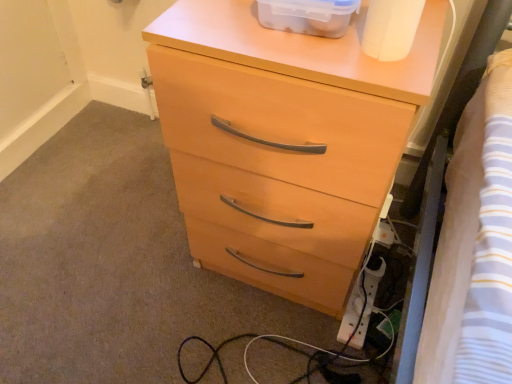
Question: Is translucent plastic container at upper center at the right side of white plastic extension cord at lower right?

Choices:
 (A) yes
 (B) no

Answer: (B)

Question: Is translucent plastic container at upper center to the left of white plastic extension cord at lower right from the viewer's perspective?

Choices:
 (A) yes
 (B) no

Answer: (A)

Question: Does translucent plastic container at upper center have a greater width compared to white plastic extension cord at lower right?

Choices:
 (A) no
 (B) yes

Answer: (A)

Question: Can you confirm if translucent plastic container at upper center is taller than white plastic extension cord at lower right?

Choices:
 (A) yes
 (B) no

Answer: (A)

Question: Is translucent plastic container at upper center bigger than white plastic extension cord at lower right?

Choices:
 (A) yes
 (B) no

Answer: (A)

Question: Is translucent plastic container at upper center far away from white plastic extension cord at lower right?

Choices:
 (A) yes
 (B) no

Answer: (B)

Question: Can you confirm if white plastic extension cord at lower right is positioned to the right of matte wood chest of drawers at center?

Choices:
 (A) no
 (B) yes

Answer: (B)

Question: Is white plastic extension cord at lower right smaller than matte wood chest of drawers at center?

Choices:
 (A) yes
 (B) no

Answer: (A)

Question: Is white plastic extension cord at lower right not within matte wood chest of drawers at center?

Choices:
 (A) yes
 (B) no

Answer: (A)

Question: Is white plastic extension cord at lower right oriented away from matte wood chest of drawers at center?

Choices:
 (A) no
 (B) yes

Answer: (A)

Question: Is white plastic extension cord at lower right not near matte wood chest of drawers at center?

Choices:
 (A) yes
 (B) no

Answer: (B)

Question: Is white plastic extension cord at lower right bigger than matte wood chest of drawers at center?

Choices:
 (A) yes
 (B) no

Answer: (B)

Question: Is matte wood chest of drawers at center at the left side of white plastic extension cord at lower right?

Choices:
 (A) no
 (B) yes

Answer: (B)